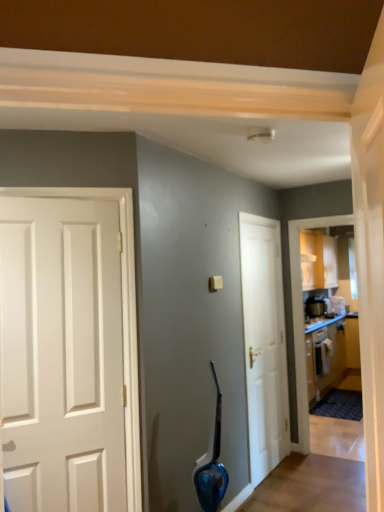
Question: Can we say white glossy door at center lies outside wooden cabinetry at right?

Choices:
 (A) no
 (B) yes

Answer: (B)

Question: Can you confirm if white glossy door at center is thinner than wooden cabinetry at right?

Choices:
 (A) no
 (B) yes

Answer: (B)

Question: Is white glossy door at center closer to the viewer compared to wooden cabinetry at right?

Choices:
 (A) no
 (B) yes

Answer: (B)

Question: Is white glossy door at center with wooden cabinetry at right?

Choices:
 (A) no
 (B) yes

Answer: (A)

Question: From a real-world perspective, is white glossy door at center over wooden cabinetry at right?

Choices:
 (A) no
 (B) yes

Answer: (B)

Question: Is white glossy door at center shorter than wooden cabinetry at right?

Choices:
 (A) no
 (B) yes

Answer: (A)

Question: Can you confirm if metallic silver toaster at right, acting as the second appliance starting from the right, is positioned to the right of metallic silver toaster at upper right, the second appliance in the left-to-right sequence?

Choices:
 (A) no
 (B) yes

Answer: (A)

Question: Is metallic silver toaster at right, which is the 1th appliance in left-to-right order, to the left of metallic silver toaster at upper right, the second appliance in the left-to-right sequence, from the viewer's perspective?

Choices:
 (A) yes
 (B) no

Answer: (A)

Question: Is metallic silver toaster at right, acting as the second appliance starting from the right, wider than metallic silver toaster at upper right, which is the first appliance in right-to-left order?

Choices:
 (A) yes
 (B) no

Answer: (B)

Question: Is metallic silver toaster at right, which is the 1th appliance in left-to-right order, not close to metallic silver toaster at upper right, the second appliance in the left-to-right sequence?

Choices:
 (A) no
 (B) yes

Answer: (A)

Question: Considering the relative sizes of metallic silver toaster at right, which is the 1th appliance in left-to-right order, and metallic silver toaster at upper right, the second appliance in the left-to-right sequence, in the image provided, is metallic silver toaster at right, which is the 1th appliance in left-to-right order, bigger than metallic silver toaster at upper right, the second appliance in the left-to-right sequence,?

Choices:
 (A) no
 (B) yes

Answer: (B)

Question: Can you confirm if metallic silver toaster at right, which is the 1th appliance in left-to-right order, is shorter than metallic silver toaster at upper right, the second appliance in the left-to-right sequence?

Choices:
 (A) no
 (B) yes

Answer: (A)

Question: Considering the relative sizes of wooden cabinetry at right and white glossy door at center in the image provided, is wooden cabinetry at right thinner than white glossy door at center?

Choices:
 (A) yes
 (B) no

Answer: (B)